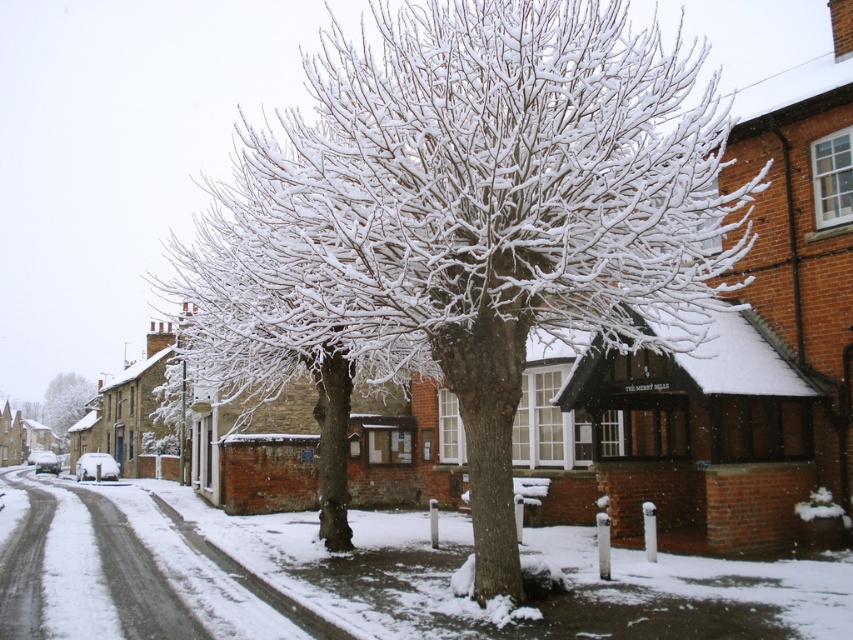
You are standing at point A which is at the base of the large tree. You want to walk to point B at point (x=352, y=577). Is the path from the large tree to point B covered in snow?

The path from the large tree to point B at point (x=352, y=577) is covered in white powdery snow at center, so yes, the path is covered in snow.